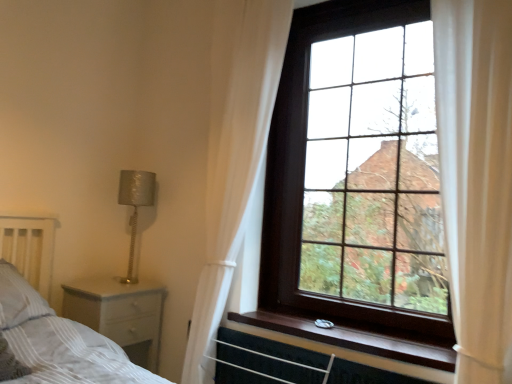
Question: Can you confirm if wooden at upper right is wider than silver textured lamp at left?

Choices:
 (A) yes
 (B) no

Answer: (A)

Question: Is wooden at upper right completely or partially outside of silver textured lamp at left?

Choices:
 (A) no
 (B) yes

Answer: (B)

Question: Is wooden at upper right oriented towards silver textured lamp at left?

Choices:
 (A) yes
 (B) no

Answer: (B)

Question: Is wooden at upper right positioned in front of silver textured lamp at left?

Choices:
 (A) yes
 (B) no

Answer: (A)

Question: Considering the relative sizes of wooden at upper right and silver textured lamp at left in the image provided, is wooden at upper right taller than silver textured lamp at left?

Choices:
 (A) no
 (B) yes

Answer: (A)

Question: Would you say dark wood window at upper right is inside or outside silver textured lamp at left?

Choices:
 (A) outside
 (B) inside

Answer: (A)

Question: In terms of height, does dark wood window at upper right look taller or shorter compared to silver textured lamp at left?

Choices:
 (A) short
 (B) tall

Answer: (B)

Question: From the image's perspective, is dark wood window at upper right located above or below silver textured lamp at left?

Choices:
 (A) below
 (B) above

Answer: (B)

Question: Does point (343, 74) appear closer or farther from the camera than point (129, 223)?

Choices:
 (A) farther
 (B) closer

Answer: (B)

Question: From the image's perspective, is white sheer curtain at right, positioned as the first curtain in front-to-back order, located above or below white striped pillow at lower left?

Choices:
 (A) above
 (B) below

Answer: (A)

Question: Considering their positions, is white sheer curtain at right, positioned as the first curtain in front-to-back order, located in front of or behind white striped pillow at lower left?

Choices:
 (A) front
 (B) behind

Answer: (A)

Question: In terms of width, does white sheer curtain at right, placed as the 1th curtain when sorted from right to left, look wider or thinner when compared to white striped pillow at lower left?

Choices:
 (A) thin
 (B) wide

Answer: (A)

Question: Is white sheer curtain at right, which is counted as the 2th curtain, starting from the left, inside the boundaries of white striped pillow at lower left, or outside?

Choices:
 (A) inside
 (B) outside

Answer: (B)

Question: Do you think silver textured lamp at left is within white wood nightstand at lower left, or outside of it?

Choices:
 (A) inside
 (B) outside

Answer: (B)

Question: In terms of height, does silver textured lamp at left look taller or shorter compared to white wood nightstand at lower left?

Choices:
 (A) short
 (B) tall

Answer: (B)